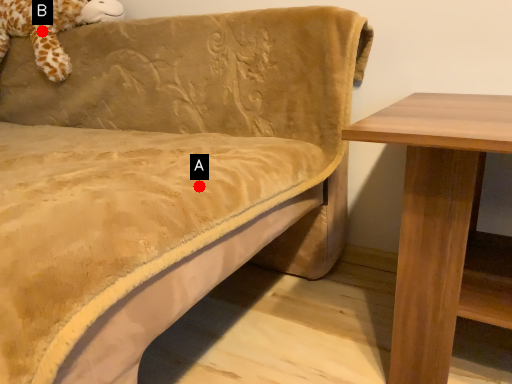
Question: Two points are circled on the image, labeled by A and B beside each circle. Which point appears closest to the camera in this image?

Choices:
 (A) A is closer
 (B) B is closer

Answer: (A)